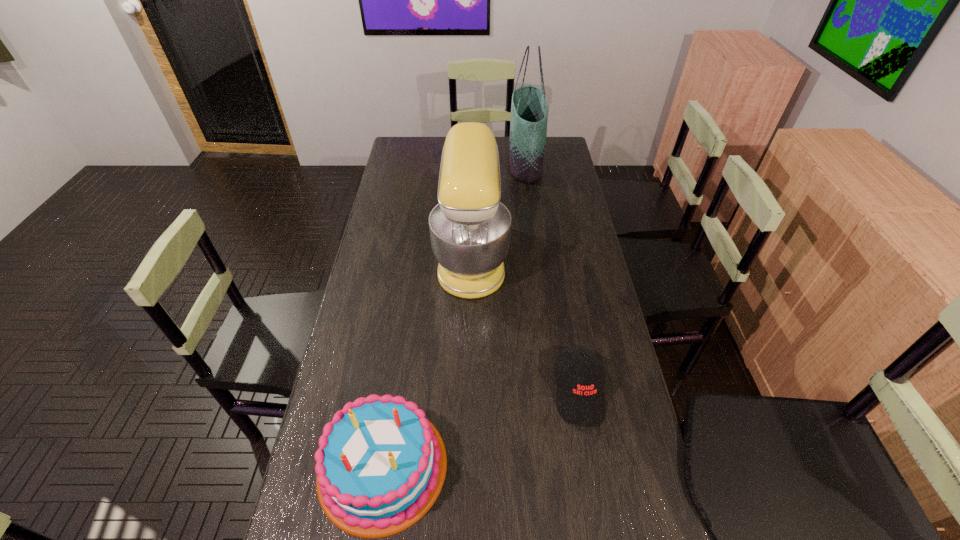
Locate an element on the screen. The width and height of the screenshot is (960, 540). vacant area between the second shortest object and the second farthest object is located at coordinates (427, 361).

Where is `vacant area that lies between the third tallest object and the mixer`? The height and width of the screenshot is (540, 960). vacant area that lies between the third tallest object and the mixer is located at coordinates (427, 361).

Where is `vacant area that lies between the mixer and the shortest object`? vacant area that lies between the mixer and the shortest object is located at coordinates coord(525,323).

Locate an element on the screen. Image resolution: width=960 pixels, height=540 pixels. object that is the second closest one to the shortest object is located at coordinates (380, 465).

Select which object appears as the closest to the birthday cake. Please provide its 2D coordinates. Your answer should be formatted as a tuple, i.e. [(x, y)], where the tuple contains the x and y coordinates of a point satisfying the conditions above.

[(580, 397)]

Locate an element on the screen. The height and width of the screenshot is (540, 960). vacant space that satisfies the following two spatial constraints: 1. on the side of the second tallest object with the control knob; 2. on the front side of the second shortest object is located at coordinates (468, 466).